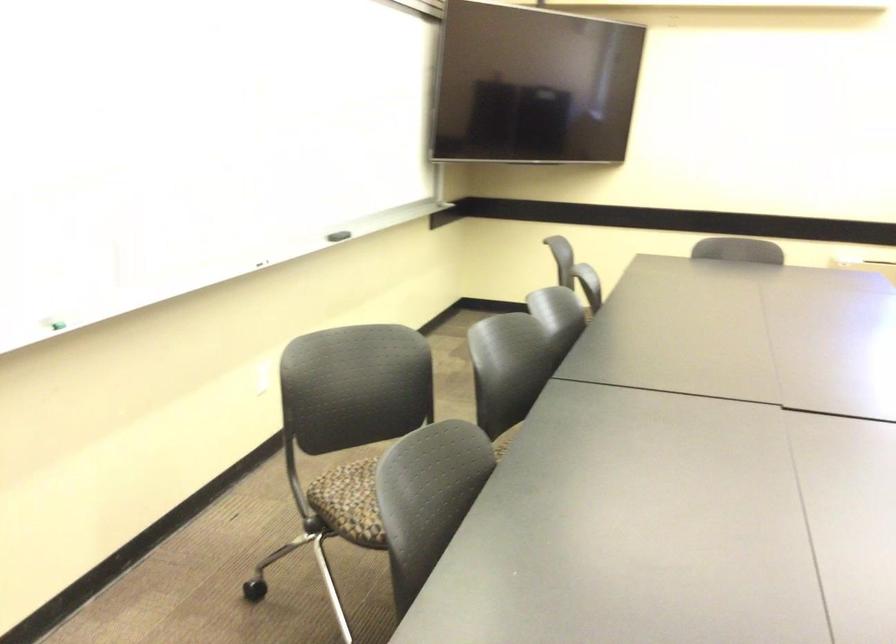
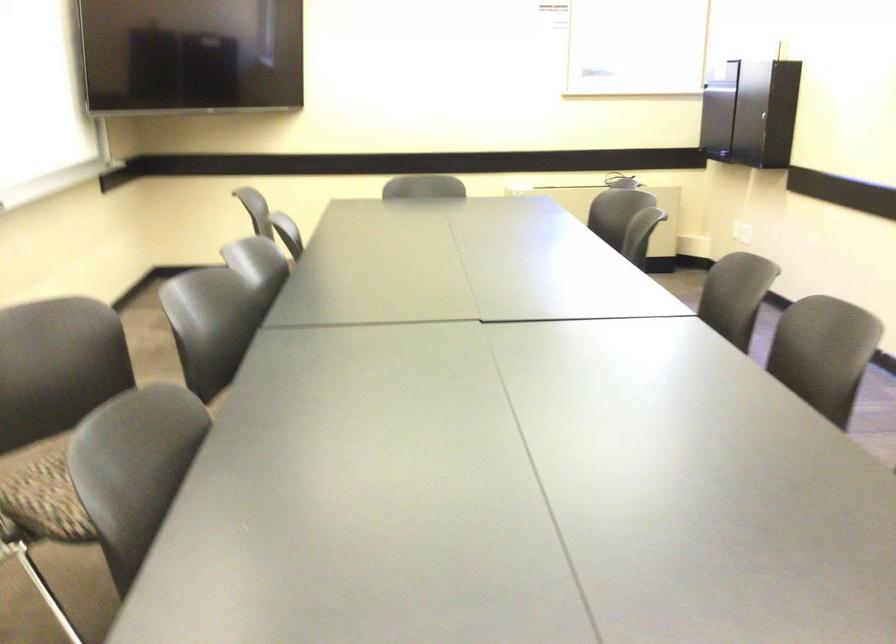
Question: How did the camera likely rotate?

Choices:
 (A) Left
 (B) Right
 (C) Up
 (D) Down

Answer: (B)